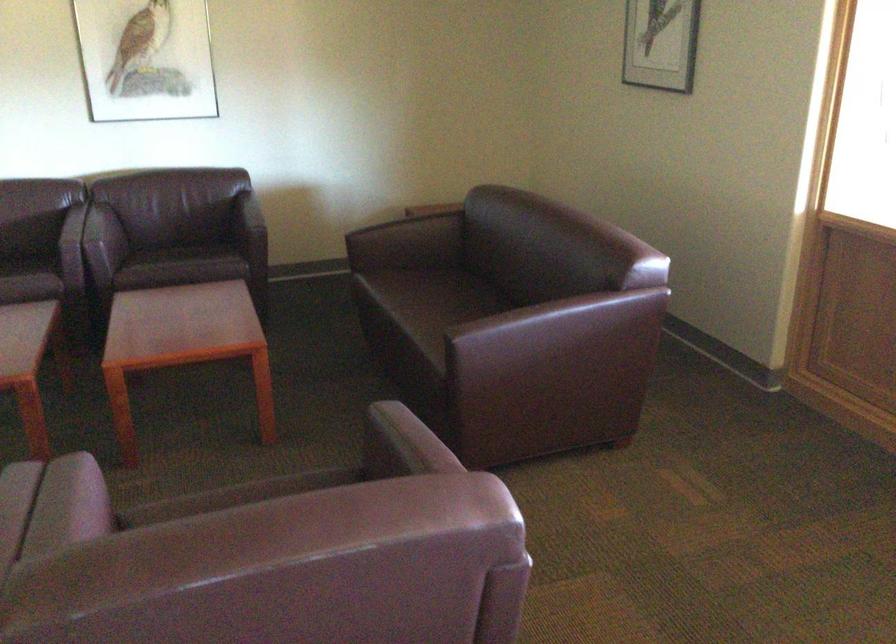
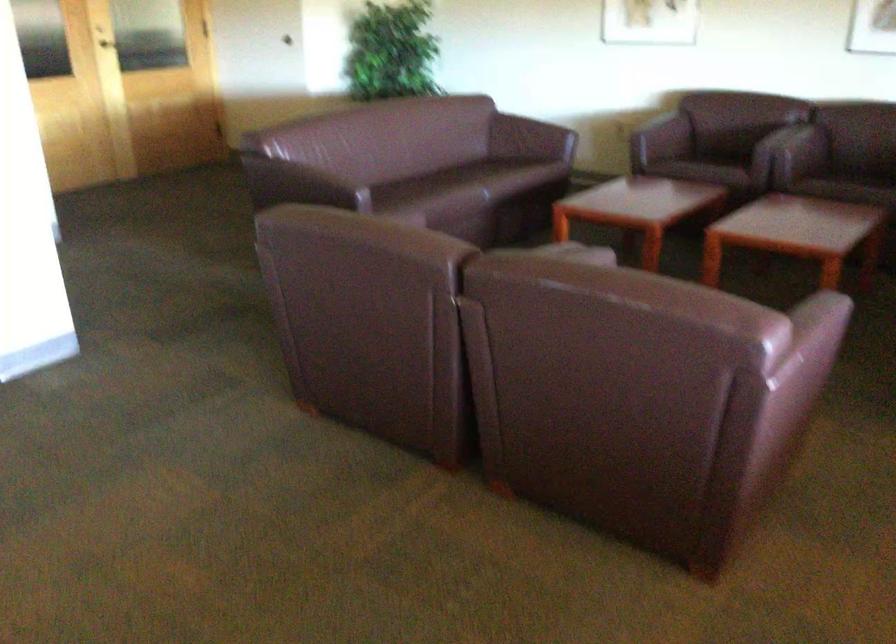
Question: The camera is either moving clockwise (left) or counter-clockwise (right) around the object. The first image is from the beginning of the video and the second image is from the end. Is the camera moving left or right when shooting the video?

Choices:
 (A) Left
 (B) Right

Answer: (B)